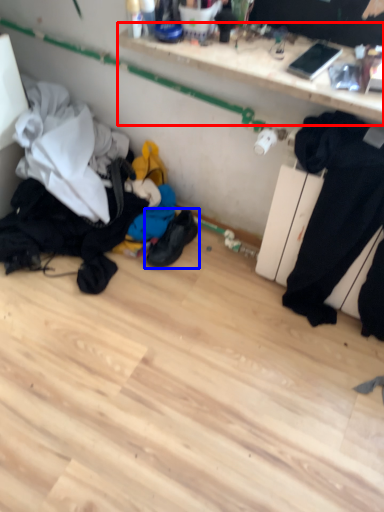
Question: Which of the following is the farthest to the observer, shelf (highlighted by a red box) or footwear (highlighted by a blue box)?

Choices:
 (A) shelf
 (B) footwear

Answer: (B)